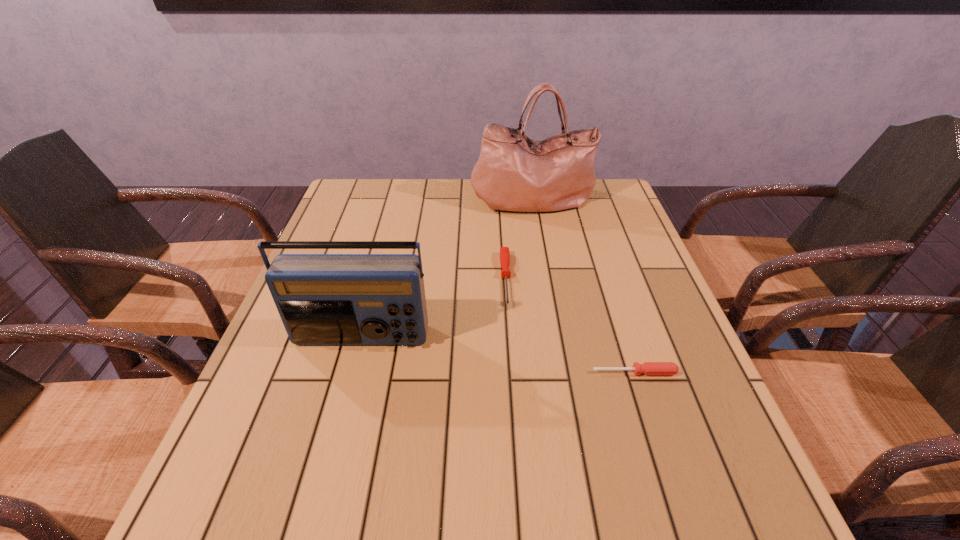
Identify the location of vacant area in the image that satisfies the following two spatial constraints: 1. on the front panel of the radio receiver; 2. on the right side of the nearer screwdriver. This screenshot has width=960, height=540. (351, 373).